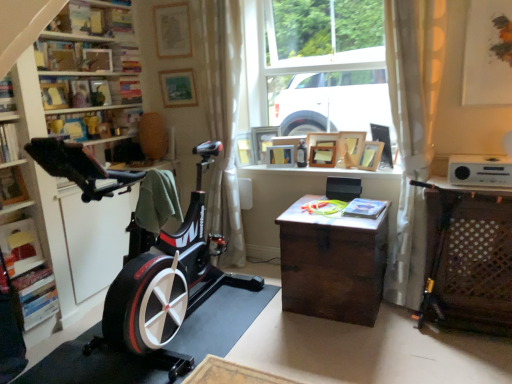
At what (x,y) coordinates should I click in order to perform the action: click on vacant area that is in front of wooden picture frame at upper center, acting as the seventh picture frame starting from the right. Please return your answer as a coordinate pair (x, y). The width and height of the screenshot is (512, 384). Looking at the image, I should click on (283, 169).